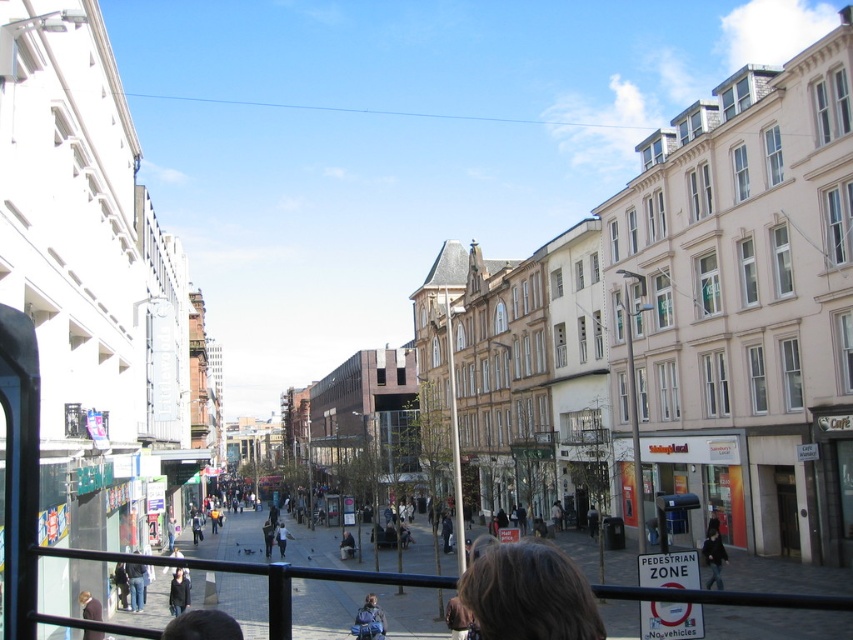
Question: Which point is farther to the camera?

Choices:
 (A) (171, 611)
 (B) (340, 540)
 (C) (90, 608)
 (D) (363, 624)

Answer: (B)

Question: Is dark blue jacket at lower right positioned behind dark brown leather jacket at lower left?

Choices:
 (A) no
 (B) yes

Answer: (B)

Question: Can you confirm if dark blue jeans at lower left is smaller than dark brown leather jacket at lower left?

Choices:
 (A) yes
 (B) no

Answer: (A)

Question: From the image, what is the correct spatial relationship of blue denim jacket at center in relation to light brown leather bag at center?

Choices:
 (A) below
 (B) above

Answer: (B)

Question: Which object appears farthest from the camera in this image?

Choices:
 (A) dark brown hair at lower center
 (B) blue denim jacket at center
 (C) dark blue jeans at lower left
 (D) light brown leather bag at center

Answer: (D)

Question: Which point is closer to the camera?

Choices:
 (A) dark blue jeans at lower left
 (B) dark brown hair at lower center
 (C) blue denim jacket at center
 (D) light brown leather bag at center

Answer: (B)